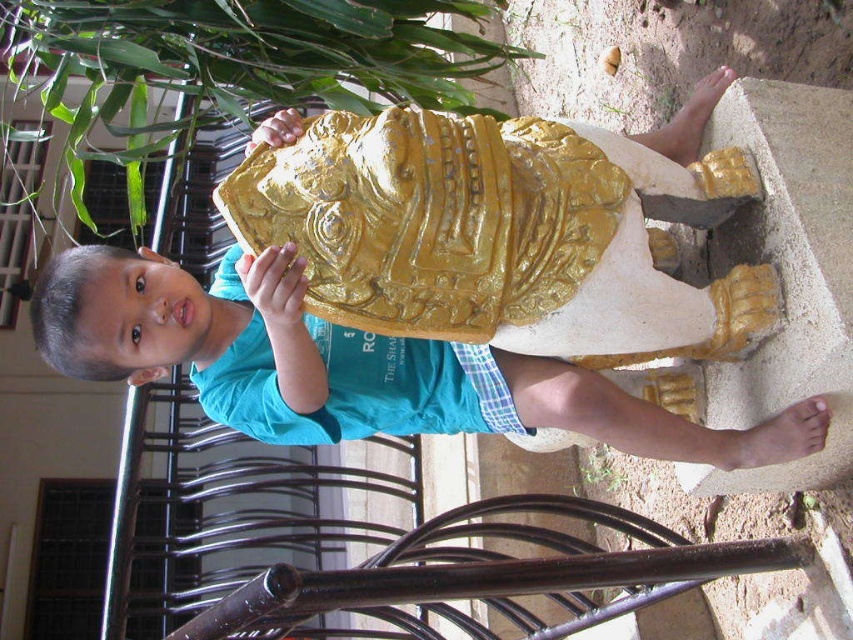
Between green leafy plant at upper left and green leafy plant at lower center, which one appears on the left side from the viewer's perspective?

green leafy plant at upper left is more to the left.

Locate an element on the screen. The height and width of the screenshot is (640, 853). green leafy plant at upper left is located at coordinates (231, 64).

This screenshot has width=853, height=640. In order to click on green leafy plant at upper left in this screenshot , I will do `click(231, 64)`.

Does matte gold statue at center have a lesser width compared to green leafy plant at upper left?

Indeed, matte gold statue at center has a lesser width compared to green leafy plant at upper left.

From the picture: Can you confirm if matte gold statue at center is bigger than green leafy plant at upper left?

Actually, matte gold statue at center might be smaller than green leafy plant at upper left.

Is point (270, 378) farther from viewer compared to point (434, 88)?

No, it is not.

Locate an element on the screen. matte gold statue at center is located at coordinates (350, 365).

Looking at this image, does matte gold statue at center come in front of green leafy plant at lower center?

Yes.

Based on the photo, who is more forward, (228, 285) or (581, 480)?

Point (228, 285)

Locate an element on the screen. The image size is (853, 640). matte gold statue at center is located at coordinates (350, 365).